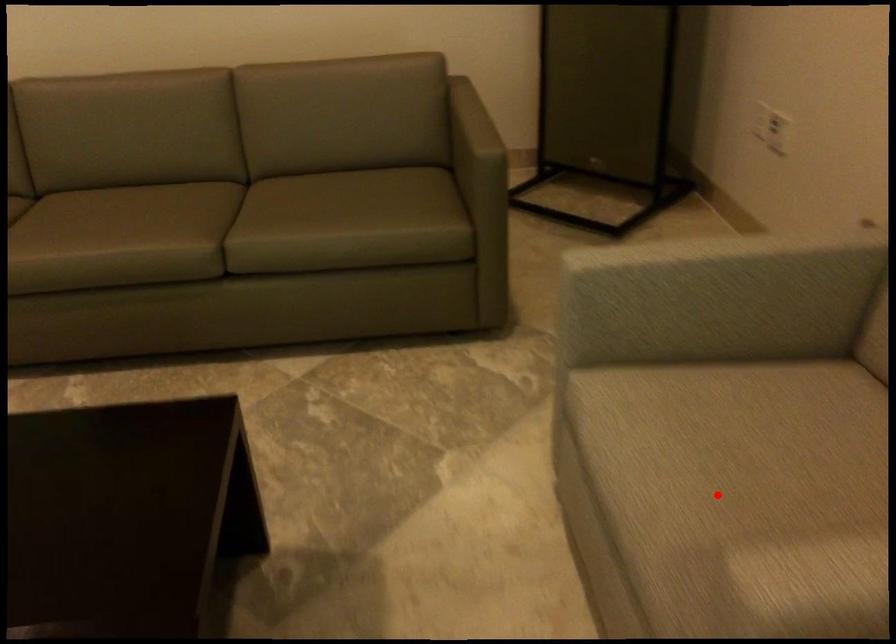
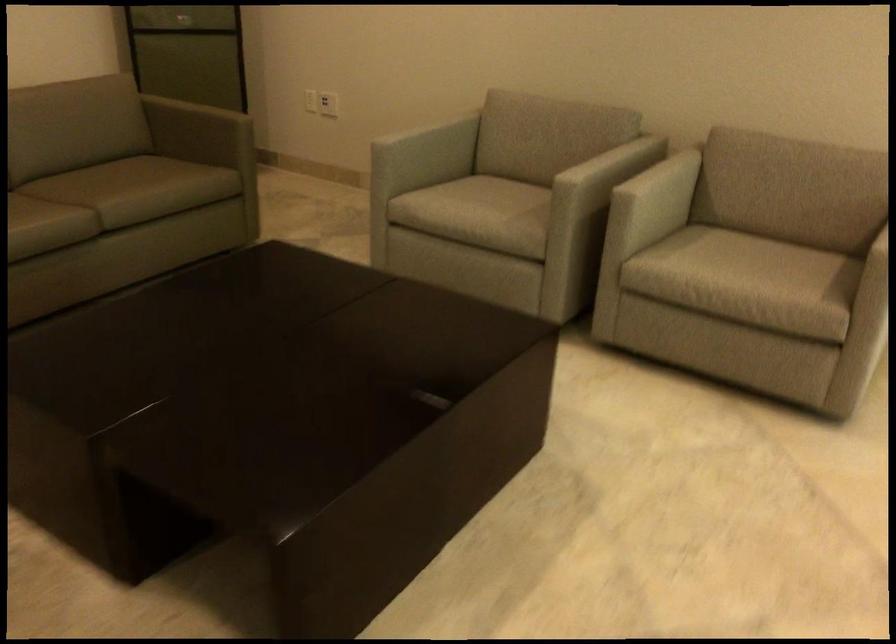
Question: I am providing you with two images of the same scene from different viewpoints. Image1 has a red point marked. In image2, the corresponding 3D location appears at what relative position? Reply with the corresponding letter.

Choices:
 (A) Closer
 (B) Farther

Answer: (B)